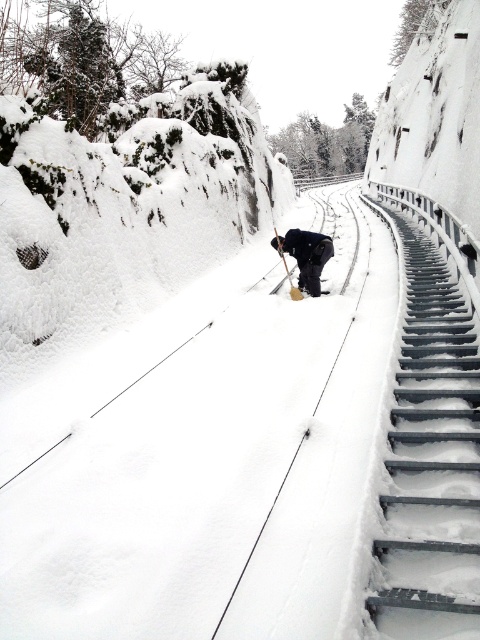
You are a maintenance worker needing to reach the snowdrift on the tracks ahead. You see the metallic gray stairs at right and the dark gray fabric at center. Which object is closer to you as you stand at the starting point?

The metallic gray stairs at right is in front of the dark gray fabric at center, so it is closer to you.

You are standing at the origin point in the snowy railway scene. The metallic gray stairs at right are located at coordinates 0.720, 0.900. If you want to reach the stairs, which direction should you move in?

The metallic gray stairs at right are located at coordinates (432, 460), so you should move towards the right side of the image to reach them.

You are a snow removal worker standing near the wooden ski pole at center. You need to reach the dark gray fabric at center to check if it poses a safety hazard. Can you walk directly to it without moving any snow?

The dark gray fabric at center is to the right of the wooden ski pole at center, so you can walk directly to it without needing to move any snow since it is positioned to your right side.